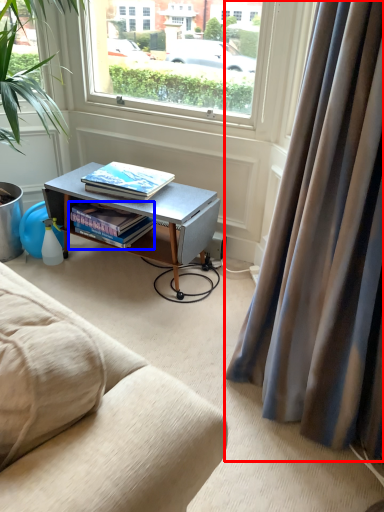
Question: Which object appears farthest to the camera in this image, curtain (highlighted by a red box) or book (highlighted by a blue box)?

Choices:
 (A) curtain
 (B) book

Answer: (B)